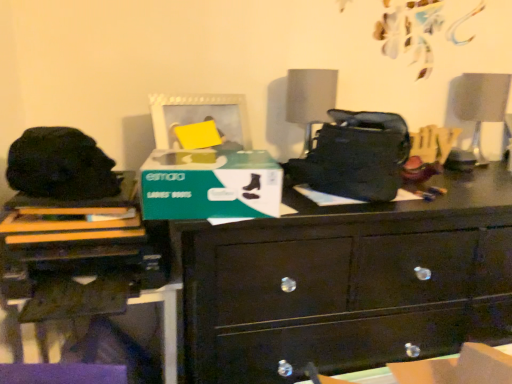
Question: Is white matte picture frame at upper center in front of matte black printer at lower left?

Choices:
 (A) yes
 (B) no

Answer: (B)

Question: Considering the relative sizes of white matte picture frame at upper center and matte black printer at lower left in the image provided, is white matte picture frame at upper center bigger than matte black printer at lower left?

Choices:
 (A) yes
 (B) no

Answer: (B)

Question: Does white matte picture frame at upper center have a greater height compared to matte black printer at lower left?

Choices:
 (A) no
 (B) yes

Answer: (A)

Question: Is white matte picture frame at upper center outside of matte black printer at lower left?

Choices:
 (A) yes
 (B) no

Answer: (A)

Question: From the image's perspective, is white matte picture frame at upper center located above matte black printer at lower left?

Choices:
 (A) yes
 (B) no

Answer: (A)

Question: From the image's perspective, is matte gray lampshade at center above or below white glossy swivel chair at upper right?

Choices:
 (A) below
 (B) above

Answer: (A)

Question: In terms of width, does matte gray lampshade at center look wider or thinner when compared to white glossy swivel chair at upper right?

Choices:
 (A) thin
 (B) wide

Answer: (B)

Question: Relative to white glossy swivel chair at upper right, is matte gray lampshade at center in front or behind?

Choices:
 (A) front
 (B) behind

Answer: (A)

Question: In terms of height, does matte gray lampshade at center look taller or shorter compared to white glossy swivel chair at upper right?

Choices:
 (A) tall
 (B) short

Answer: (B)

Question: Is point (502, 84) closer or farther from the camera than point (448, 339)?

Choices:
 (A) closer
 (B) farther

Answer: (B)

Question: In terms of size, does white glossy swivel chair at upper right appear bigger or smaller than glossy dark wood drawer at lower center?

Choices:
 (A) small
 (B) big

Answer: (A)

Question: Relative to glossy dark wood drawer at lower center, is white glossy swivel chair at upper right in front or behind?

Choices:
 (A) behind
 (B) front

Answer: (A)

Question: From their relative heights in the image, would you say white glossy swivel chair at upper right is taller or shorter than glossy dark wood drawer at lower center?

Choices:
 (A) short
 (B) tall

Answer: (B)

Question: Does point (472, 87) appear closer or farther from the camera than point (238, 97)?

Choices:
 (A) farther
 (B) closer

Answer: (A)

Question: Is white glossy swivel chair at upper right taller or shorter than white matte picture frame at upper center?

Choices:
 (A) tall
 (B) short

Answer: (A)